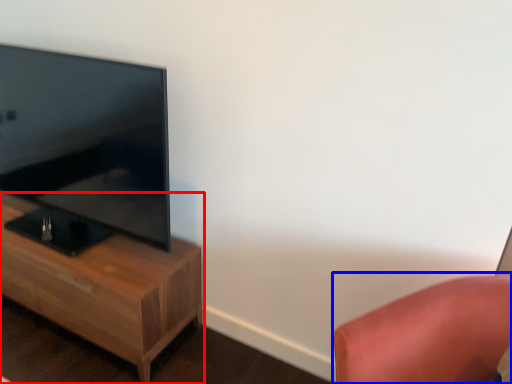
Question: Which object is further to the camera taking this photo, nightstand (highlighted by a red box) or furniture (highlighted by a blue box)?

Choices:
 (A) nightstand
 (B) furniture

Answer: (A)